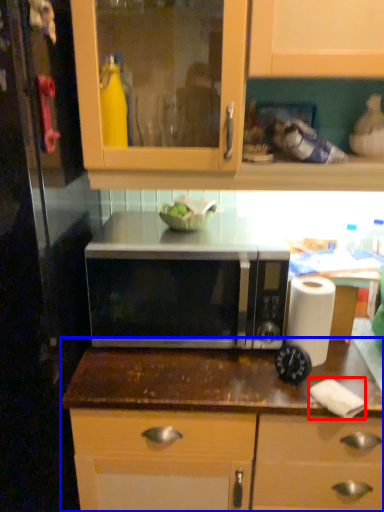
Question: Which point is closer to the camera, toilet paper (highlighted by a red box) or countertop (highlighted by a blue box)?

Choices:
 (A) toilet paper
 (B) countertop

Answer: (A)